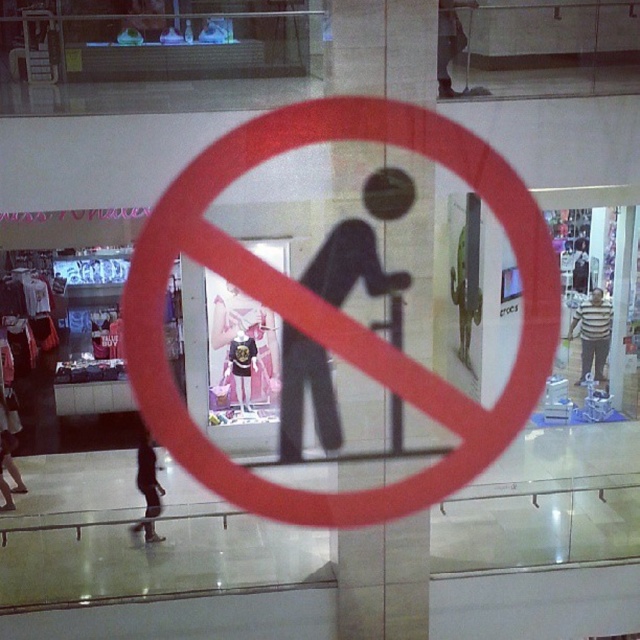
You are standing at the entrance of the clothing store and want to take a photo of the two points mentioned. Which point, point [420,52] or point [595,364], will appear larger in your photo?

Point [420,52] will appear larger in the photo because it is closer to the camera than point [595,364].

You are a customer in the mall and want to pick up the dark gray pants at lower left. There is a black matte pillar at center nearby. Can you walk around the pillar to reach the pants?

The black matte pillar at center has a lesser width compared to dark gray pants at lower left, so it is narrower. You can walk around the pillar to reach the dark gray pants at lower left.